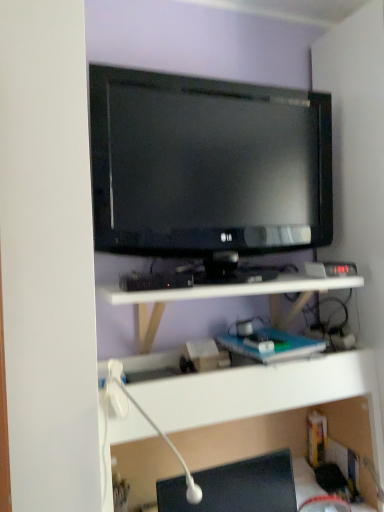
The image size is (384, 512). Find the location of `free space above white matte shelf at center, which is counted as the first shelf, starting from the top (from a real-world perspective)`. free space above white matte shelf at center, which is counted as the first shelf, starting from the top (from a real-world perspective) is located at coordinates (220, 283).